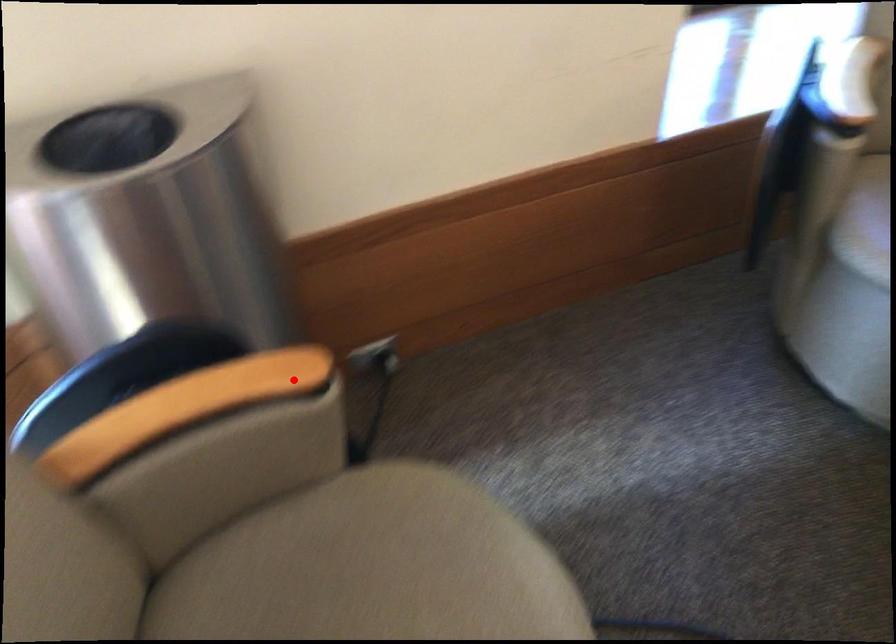
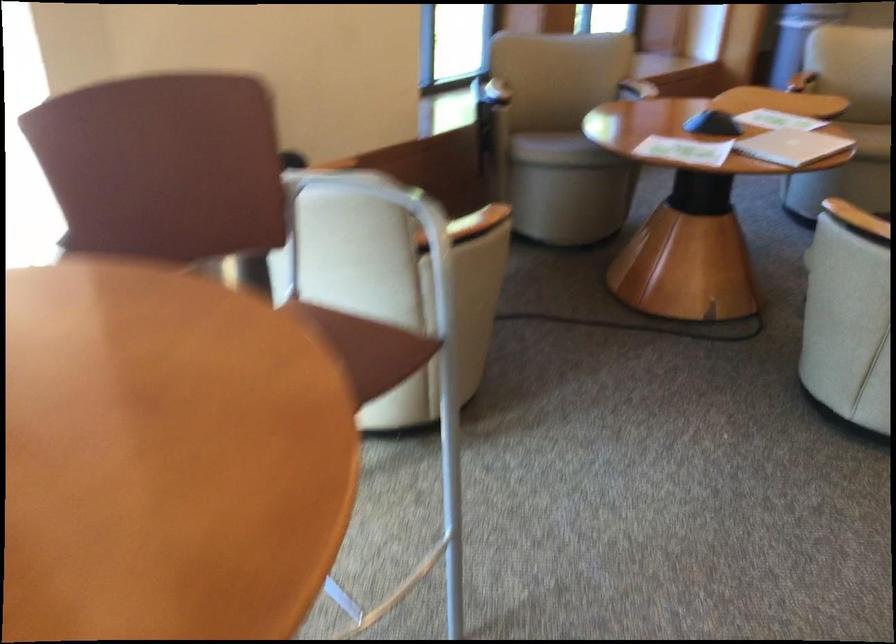
Question: I am providing you with two images of the same scene from different viewpoints. A red point is shown in image1. For the corresponding object point in image2, is it positioned nearer or farther from the camera?

Choices:
 (A) Nearer
 (B) Farther

Answer: (B)